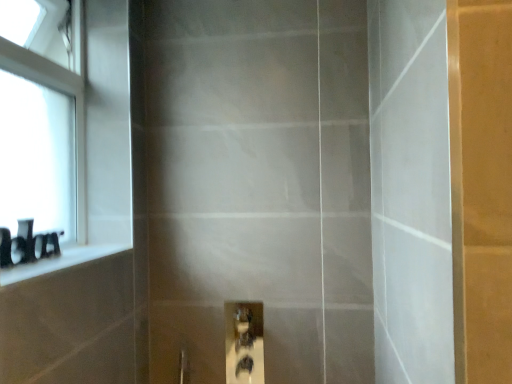
Question: Looking at their shapes, would you say black matte toiletries at left is wider or thinner than matte glass screen door at center?

Choices:
 (A) wide
 (B) thin

Answer: (B)

Question: In terms of size, does black matte toiletries at left appear bigger or smaller than matte glass screen door at center?

Choices:
 (A) small
 (B) big

Answer: (A)

Question: Estimate the real-world distances between objects in this image. Which object is farther from the white glass window at upper left?

Choices:
 (A) black matte toiletries at left
 (B) matte glass screen door at center
 (C) black glossy ledge at left

Answer: (A)

Question: Estimate the real-world distances between objects in this image. Which object is farther from the white glass window at upper left?

Choices:
 (A) matte glass screen door at center
 (B) black matte toiletries at left
 (C) black glossy ledge at left

Answer: (B)